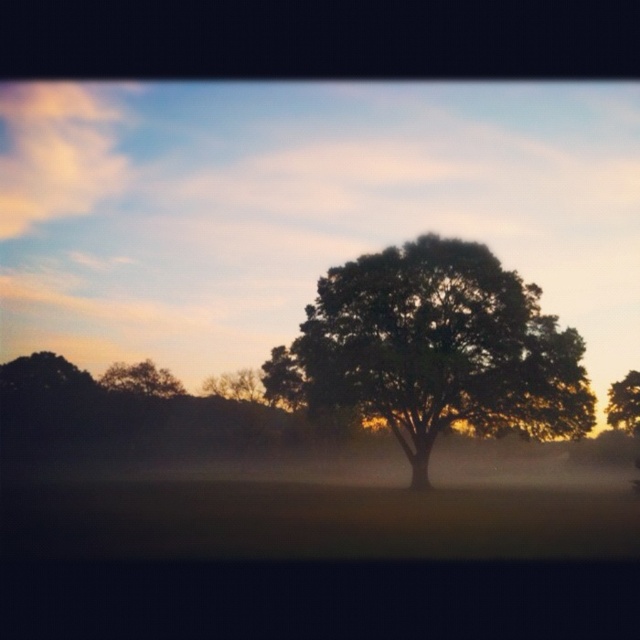
Based on the scene description, where is the green leafy tree at center located in terms of coordinates?

The green leafy tree at center is located at coordinates point (301, 209).

You are an artist planning to paint the landscape scene. You want to ensure the green leafy oak tree at center and the green leafy tree at right are proportionally accurate. Which tree should you make thinner in your painting?

The green leafy oak tree at center should be made thinner than the green leafy tree at right in the painting to maintain proportional accuracy.